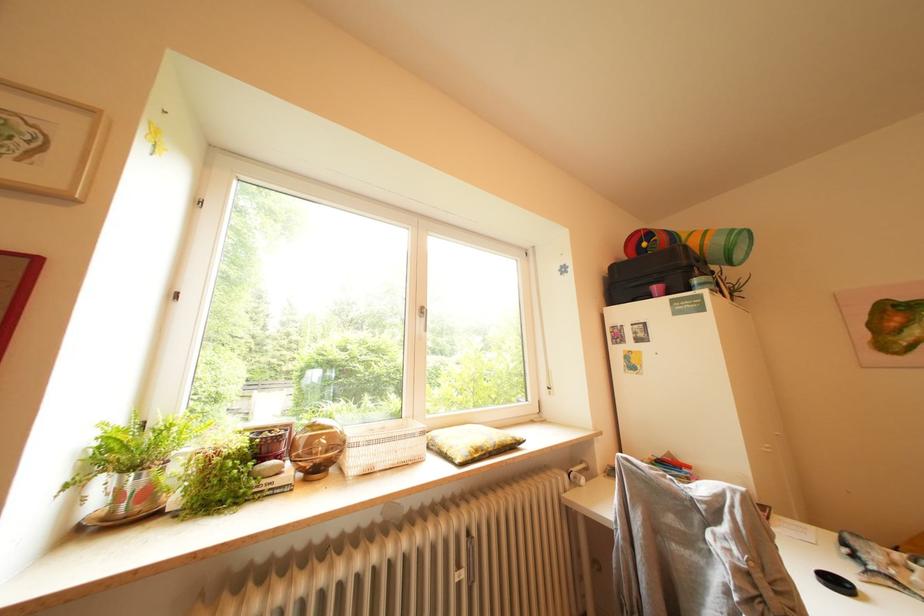
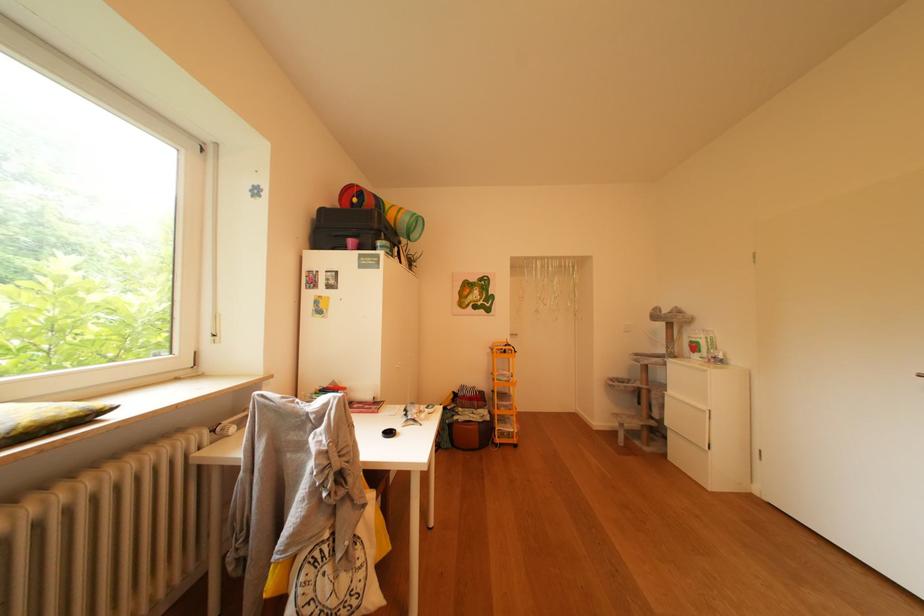
Question: The camera is either moving clockwise (left) or counter-clockwise (right) around the object. The first image is from the beginning of the video and the second image is from the end. Is the camera moving left or right when shooting the video?

Choices:
 (A) Left
 (B) Right

Answer: (A)